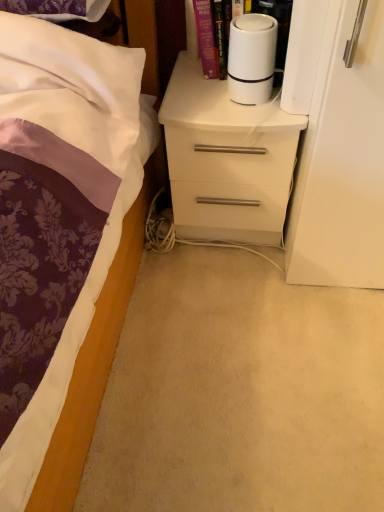
Where is `vacant space to the left of white matte cylindrical device at upper right`? This screenshot has width=384, height=512. vacant space to the left of white matte cylindrical device at upper right is located at coordinates (179, 83).